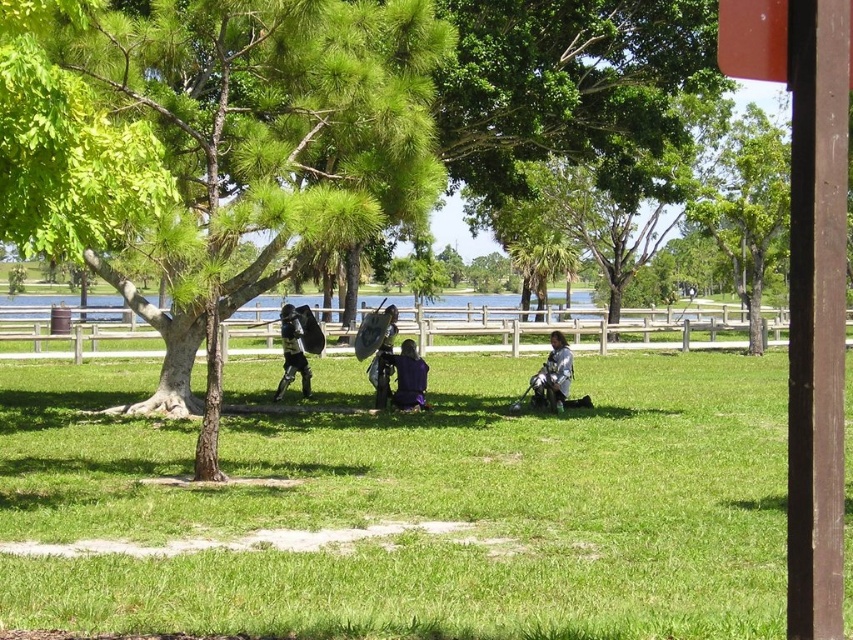
Consider the image. You are standing at the point marked as point (419, 506) in the image. What type of ground surface are you currently standing on?

The point (419, 506) is on green grass at center, so you are standing on green grass.

You are a hiker who has just arrived at the park and see the purple fabric backpack at center and the shiny silver armor at center. Which item is positioned to the right when looking at them from your perspective?

The shiny silver armor at center is positioned to the right of the purple fabric backpack at center, so the shiny silver armor at center is on the right side.

You are a painter setting up your easel in the park. You want to paint both the green leafy tree at center and the shiny silver armor at center. Which object should you focus on first if you want to paint the larger one?

The green leafy tree at center is bigger than the shiny silver armor at center, so you should focus on painting the green leafy tree at center first.